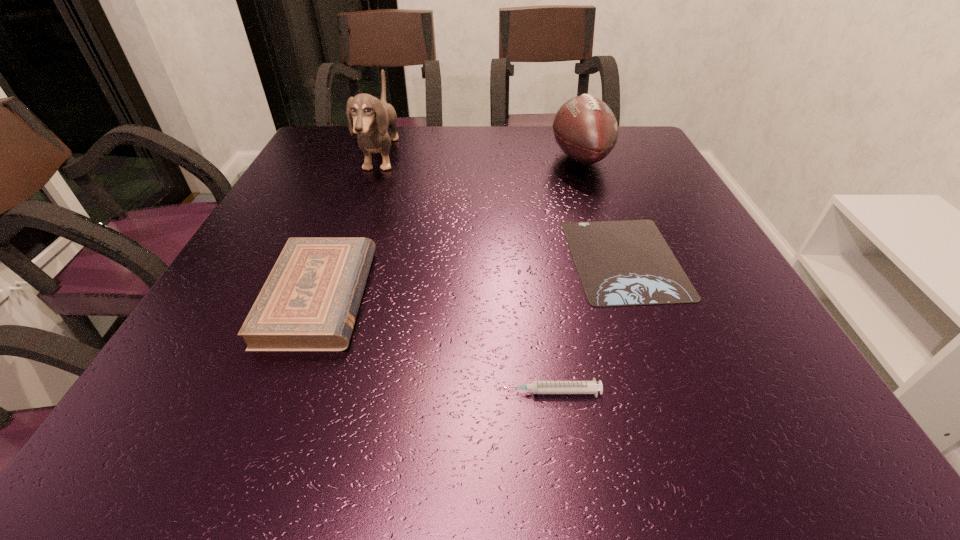
The image size is (960, 540). Find the location of `vacant region between the mousepad and the nearest object`. vacant region between the mousepad and the nearest object is located at coordinates (587, 325).

At what (x,y) coordinates should I click in order to perform the action: click on vacant space that's between the tallest object and the third object from left to right. Please return your answer as a coordinate pair (x, y). The height and width of the screenshot is (540, 960). Looking at the image, I should click on (465, 274).

Where is `vacant area between the nearest object and the third tallest object`? Image resolution: width=960 pixels, height=540 pixels. vacant area between the nearest object and the third tallest object is located at coordinates (434, 344).

Image resolution: width=960 pixels, height=540 pixels. What are the coordinates of `free space that is in between the third tallest object and the syringe` in the screenshot? It's located at (434, 344).

At what (x,y) coordinates should I click in order to perform the action: click on vacant area that lies between the tallest object and the third shortest object. Please return your answer as a coordinate pair (x, y). This screenshot has width=960, height=540. Looking at the image, I should click on (350, 227).

This screenshot has width=960, height=540. Identify the location of unoccupied position between the second shortest object and the tallest object. (465, 274).

Identify which object is the second nearest to the shortest object. Please provide its 2D coordinates. Your answer should be formatted as a tuple, i.e. [(x, y)], where the tuple contains the x and y coordinates of a point satisfying the conditions above.

[(585, 128)]

What are the coordinates of `object that ranks as the second closest to the football (American)` in the screenshot? It's located at (372, 117).

The width and height of the screenshot is (960, 540). Find the location of `free space that satisfies the following two spatial constraints: 1. on the front side of the mousepad; 2. on the right side of the second tallest object`. free space that satisfies the following two spatial constraints: 1. on the front side of the mousepad; 2. on the right side of the second tallest object is located at coordinates (616, 259).

The width and height of the screenshot is (960, 540). Find the location of `free location that satisfies the following two spatial constraints: 1. at the face of the tallest object; 2. on the back side of the mousepad`. free location that satisfies the following two spatial constraints: 1. at the face of the tallest object; 2. on the back side of the mousepad is located at coordinates (345, 259).